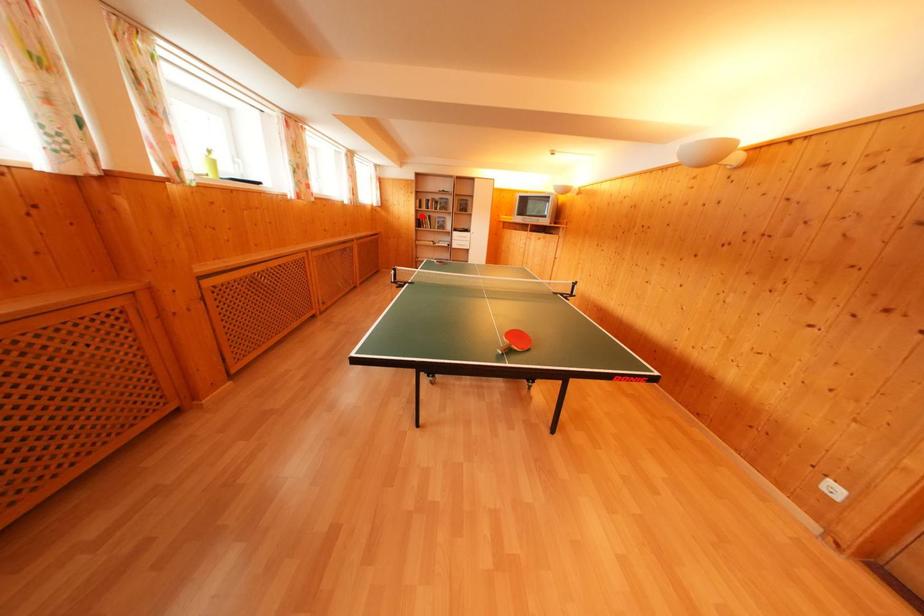
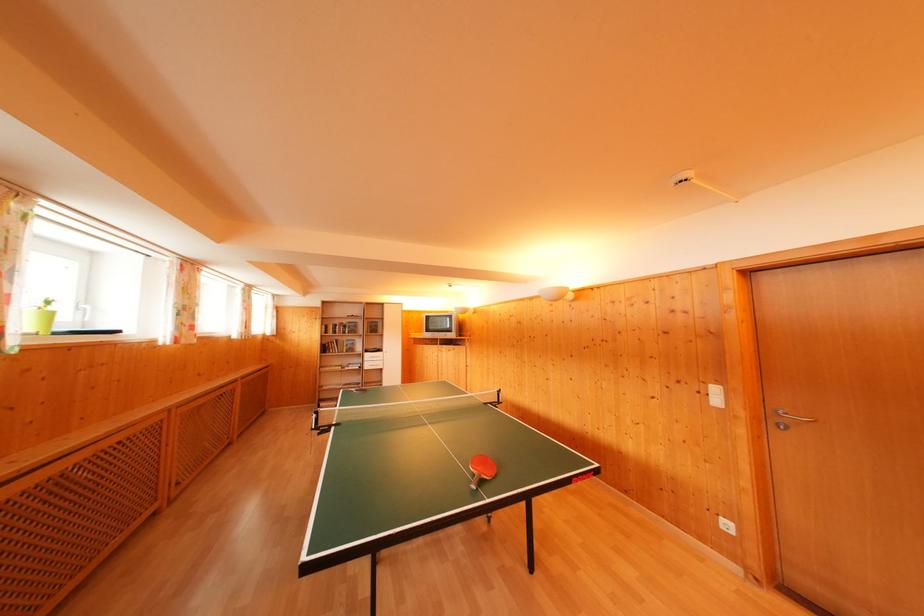
Question: I am providing you with two images of the same scene from different viewpoints. A red point is shown in image1. For the corresponding object point in image2, is it positioned nearer or farther from the camera?

Choices:
 (A) Nearer
 (B) Farther

Answer: (B)